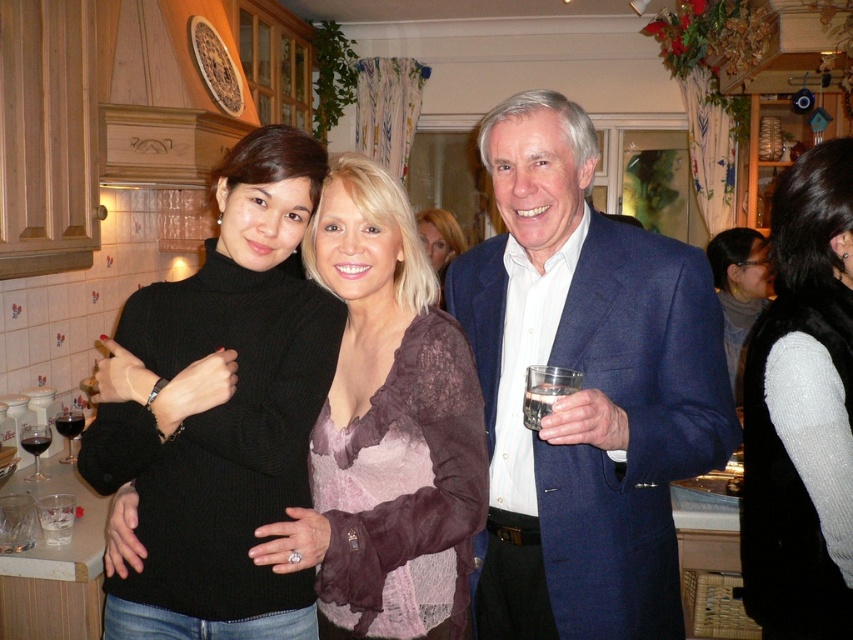
Who is lower down, clear glass at right or transparent glass at left?

transparent glass at left is below.

Who is positioned more to the right, clear glass at right or transparent glass at left?

From the viewer's perspective, clear glass at right appears more on the right side.

Does point (556, 381) come behind point (68, 426)?

No, it is in front of (68, 426).

Where is `clear glass at right`? clear glass at right is located at coordinates (544, 394).

Describe the element at coordinates (440, 241) in the screenshot. This screenshot has width=853, height=640. I see `matte purple lace top at center` at that location.

Between matte purple lace top at center and transparent glass at lower left, which one appears on the right side from the viewer's perspective?

Positioned to the right is matte purple lace top at center.

Describe the element at coordinates (440, 241) in the screenshot. I see `matte purple lace top at center` at that location.

Image resolution: width=853 pixels, height=640 pixels. What are the coordinates of `matte purple lace top at center` in the screenshot? It's located at (440, 241).

Measure the distance between black turtleneck sweater at center and matte purple lace top at center.

They are 7.01 feet apart.

What do you see at coordinates (219, 408) in the screenshot? This screenshot has width=853, height=640. I see `black turtleneck sweater at center` at bounding box center [219, 408].

Is point (271, 592) in front of point (439, 237)?

That is True.

In order to click on black turtleneck sweater at center in this screenshot , I will do `click(219, 408)`.